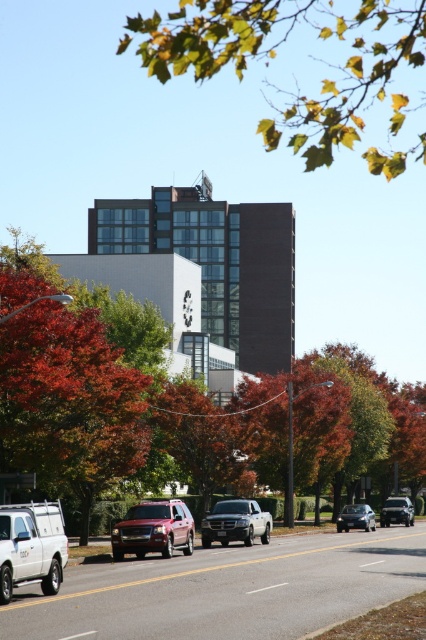
You are a drone operator trying to capture aerial footage of the street scene. You notice two points of interest marked at coordinates point (80, 330) and point (236, 509). Which point is closer to your drone camera lens?

Point (80, 330) is closer to the camera than point (236, 509).

You are standing at the intersection and need to cross the street to reach the white matte truck at lower left. The crosswalk is located at point [31,547]. Is the crosswalk directly in front of the white matte truck at lower left?

The crosswalk at point [31,547] corresponds to the white matte truck at lower left, so yes, the crosswalk is directly in front of the white matte truck at lower left.

From the picture: You are a pedestrian standing on the sidewalk and want to cross the street. You see an orange leafy tree at center and a satin black sedan at center. Which object is closer to your left side when facing the street?

The orange leafy tree at center is positioned on the left side of the satin black sedan at center, so when facing the street, the orange leafy tree at center would be closer to your left side.